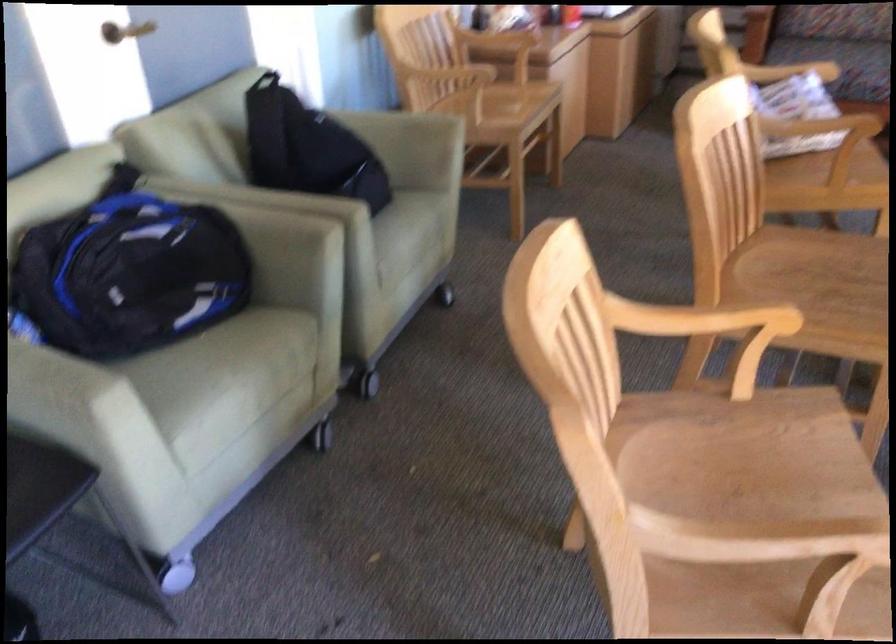
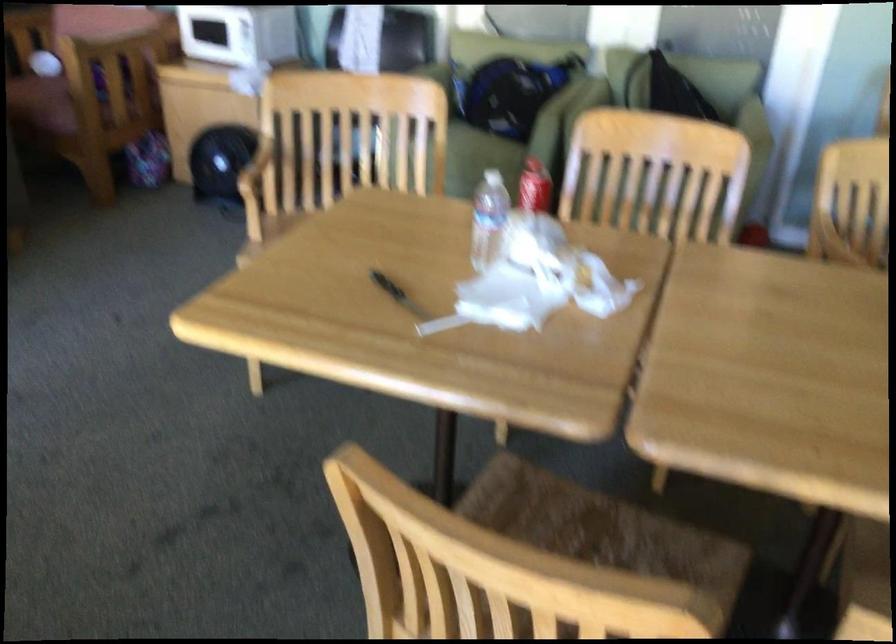
Question: I am providing you with two images of the same scene from different viewpoints. After the viewpoint changes to image2, which objects are now occluded?

Choices:
 (A) chair armrest
 (B) caster wheel
 (C) plastic water bottle
 (D) door pull handle

Answer: (B)